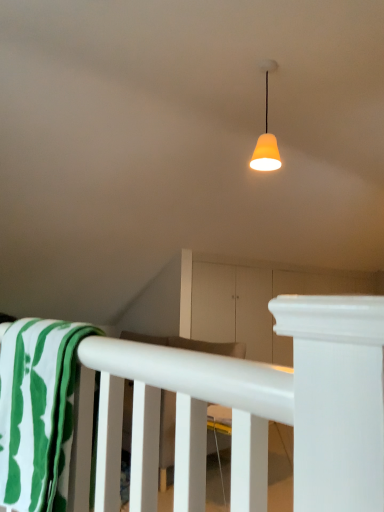
Question: Considering their positions, is green striped fabric at lower left located in front of or behind white matte rail at lower center?

Choices:
 (A) front
 (B) behind

Answer: (A)

Question: Based on their positions, is green striped fabric at lower left located to the left or right of white matte rail at lower center?

Choices:
 (A) right
 (B) left

Answer: (B)

Question: Which object is the farthest from the white matte rail at lower center?

Choices:
 (A) green striped fabric at lower left
 (B) matte orange lampshade at upper center

Answer: (B)

Question: Which object is positioned farthest from the green striped fabric at lower left?

Choices:
 (A) matte orange lampshade at upper center
 (B) white matte rail at lower center

Answer: (A)